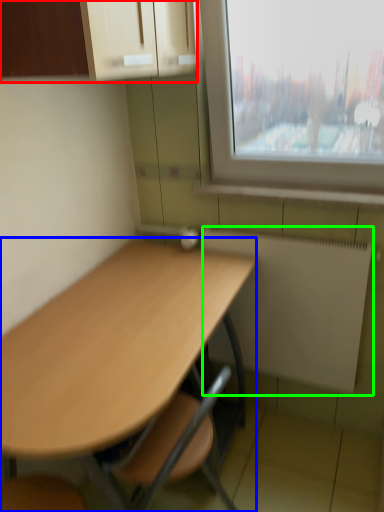
Question: Which object is the closest to the cabinetry (highlighted by a red box)? Choose among these: desk (highlighted by a blue box) or radiator (highlighted by a green box).

Choices:
 (A) desk
 (B) radiator

Answer: (A)